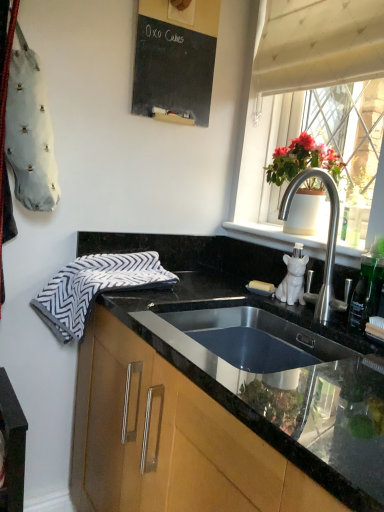
Locate an element on the screen. The image size is (384, 512). matte white pot at right is located at coordinates (303, 160).

Image resolution: width=384 pixels, height=512 pixels. Describe the element at coordinates (175, 60) in the screenshot. I see `black chalkboard at upper center` at that location.

At what (x,y) coordinates should I click in order to perform the action: click on white textured curtain at upper right. Please return your answer as a coordinate pair (x, y). Image resolution: width=384 pixels, height=512 pixels. Looking at the image, I should click on (318, 44).

From a real-world perspective, which object rests below the other?

translucent glass window at upper right.

Is point (249, 158) farther from viewer compared to point (342, 0)?

Yes.

Does translucent glass window at upper right have a smaller size compared to white textured curtain at upper right?

Actually, translucent glass window at upper right might be larger than white textured curtain at upper right.

Does translucent glass window at upper right appear on the right side of white textured curtain at upper right?

Indeed, translucent glass window at upper right is positioned on the right side of white textured curtain at upper right.

How much distance is there between white ceramic cat at right and matte white pot at right?

16.72 centimeters.

Would you say white ceramic cat at right is a long distance from matte white pot at right?

white ceramic cat at right is near matte white pot at right, not far away.

Based on the photo, is white ceramic cat at right inside the boundaries of matte white pot at right, or outside?

white ceramic cat at right lies outside matte white pot at right.

Relative to matte white pot at right, is white ceramic cat at right in front or behind?

white ceramic cat at right is positioned closer to the viewer than matte white pot at right.

Based on the photo, is wooden cabinet at lower center in contact with gray and white zigzag-patterned hand towel at left?

There is a gap between wooden cabinet at lower center and gray and white zigzag-patterned hand towel at left.

Which of these two, wooden cabinet at lower center or gray and white zigzag-patterned hand towel at left, stands shorter?

With less height is gray and white zigzag-patterned hand towel at left.

Is point (88, 450) more distant than point (75, 324)?

Yes.

Does wooden cabinet at lower center have a greater width compared to gray and white zigzag-patterned hand towel at left?

Indeed, wooden cabinet at lower center has a greater width compared to gray and white zigzag-patterned hand towel at left.

Based on the photo, is white ceramic cat at right facing towards translucent glass window at upper right?

No, white ceramic cat at right is not turned towards translucent glass window at upper right.

How distant is white ceramic cat at right from translucent glass window at upper right?

A distance of 10.00 inches exists between white ceramic cat at right and translucent glass window at upper right.

From a real-world perspective, is white ceramic cat at right positioned above or below translucent glass window at upper right?

Clearly, from a real-world perspective, white ceramic cat at right is below translucent glass window at upper right.

Is white ceramic cat at right outside of wooden cabinet at lower center?

Absolutely, white ceramic cat at right is external to wooden cabinet at lower center.

Considering the sizes of objects white ceramic cat at right and wooden cabinet at lower center in the image provided, who is shorter, white ceramic cat at right or wooden cabinet at lower center?

white ceramic cat at right is shorter.

Which is closer to the camera, (259, 241) or (80, 451)?

Point (259, 241).

Can you confirm if translucent glass window at upper right is shorter than matte white pot at right?

No, translucent glass window at upper right is not shorter than matte white pot at right.

Between point (289, 38) and point (332, 162), which one is positioned in front?

The point (332, 162) is closer to the camera.

Is translucent glass window at upper right turned away from matte white pot at right?

Yes, translucent glass window at upper right's orientation is away from matte white pot at right.

What's the angular difference between gray and white zigzag-patterned hand towel at left and white textured curtain at upper right's facing directions?

There is a 0.776-degree angle between the facing directions of gray and white zigzag-patterned hand towel at left and white textured curtain at upper right.

From the image's perspective, does gray and white zigzag-patterned hand towel at left appear lower than white textured curtain at upper right?

Indeed, from the image's perspective, gray and white zigzag-patterned hand towel at left is shown beneath white textured curtain at upper right.

In the scene shown: Would you say gray and white zigzag-patterned hand towel at left is inside or outside white textured curtain at upper right?

gray and white zigzag-patterned hand towel at left is not enclosed by white textured curtain at upper right.

Locate an element on the screen. window that is below the white textured curtain at upper right (from the image's perspective) is located at coordinates (314, 111).

Where is `window sill that appears on the left of matte white pot at right`? This screenshot has height=512, width=384. window sill that appears on the left of matte white pot at right is located at coordinates (275, 237).

Considering their positions, is white textured curtain at upper right positioned further to black chalkboard at upper center than matte white pot at right?

Based on the image, matte white pot at right appears to be further to black chalkboard at upper center.

Estimate the real-world distances between objects in this image. Which object is closer to matte white pot at right, translucent glass window at upper right or wooden cabinet at lower center?

translucent glass window at upper right is positioned closer to the anchor matte white pot at right.

When comparing their distances from gray and white zigzag-patterned hand towel at left, does matte white pot at right or white ceramic cat at right seem closer?

Among the two, white ceramic cat at right is located nearer to gray and white zigzag-patterned hand towel at left.

Which object lies further to the anchor point white ceramic cat at right, matte white pot at right or white textured curtain at upper right?

white textured curtain at upper right.

Based on their spatial positions, is wooden cabinet at lower center or gray and white zigzag-patterned hand towel at left closer to translucent glass window at upper right?

gray and white zigzag-patterned hand towel at left lies closer to translucent glass window at upper right than the other object.

Estimate the real-world distances between objects in this image. Which object is further from translucent glass window at upper right, gray and white zigzag-patterned hand towel at left or white textured curtain at upper right?

Based on the image, gray and white zigzag-patterned hand towel at left appears to be further to translucent glass window at upper right.

From the picture: Based on their spatial positions, is black chalkboard at upper center or gray and white zigzag-patterned hand towel at left further from white textured curtain at upper right?

gray and white zigzag-patterned hand towel at left lies further to white textured curtain at upper right than the other object.

From the image, which object appears to be farther from translucent glass window at upper right, black chalkboard at upper center or gray and white zigzag-patterned hand towel at left?

The object further to translucent glass window at upper right is gray and white zigzag-patterned hand towel at left.

Where is `houseplant between translucent glass window at upper right and wooden cabinet at lower center in the vertical direction`? houseplant between translucent glass window at upper right and wooden cabinet at lower center in the vertical direction is located at coordinates (303, 160).

At what (x,y) coordinates should I click in order to perform the action: click on window between white textured curtain at upper right and wooden cabinet at lower center in the vertical direction. Please return your answer as a coordinate pair (x, y). Image resolution: width=384 pixels, height=512 pixels. Looking at the image, I should click on 314,111.

I want to click on window that lies between white textured curtain at upper right and matte white pot at right from top to bottom, so tap(314, 111).

This screenshot has width=384, height=512. I want to click on curtain between black chalkboard at upper center and translucent glass window at upper right from left to right, so click(318, 44).